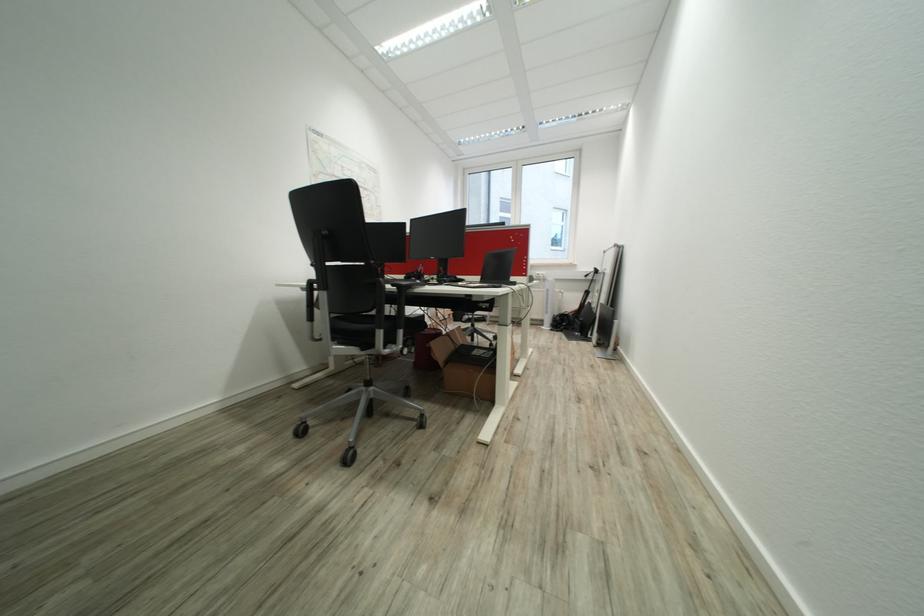
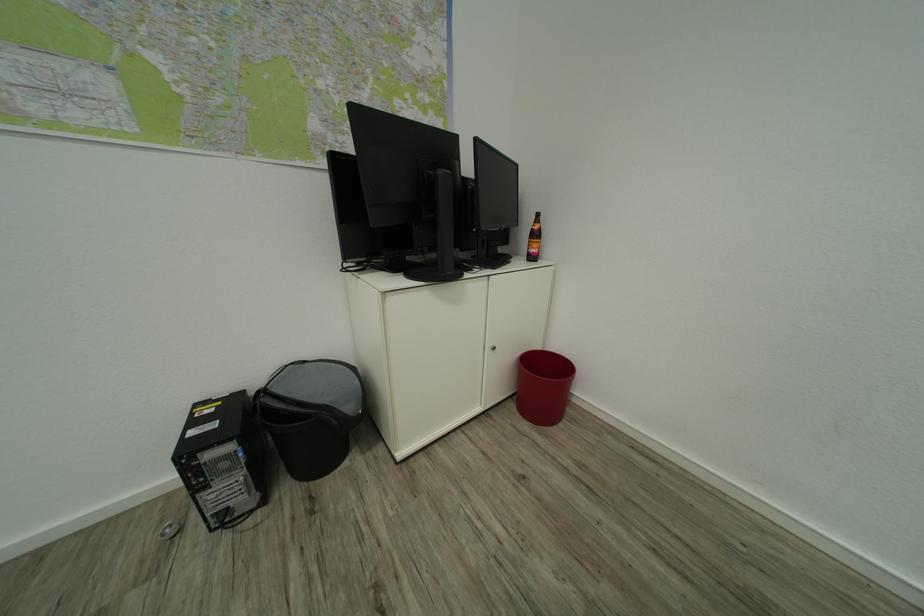
Based on the continuous images, in which direction is the camera rotating?

The rotation direction of the camera is left-down.